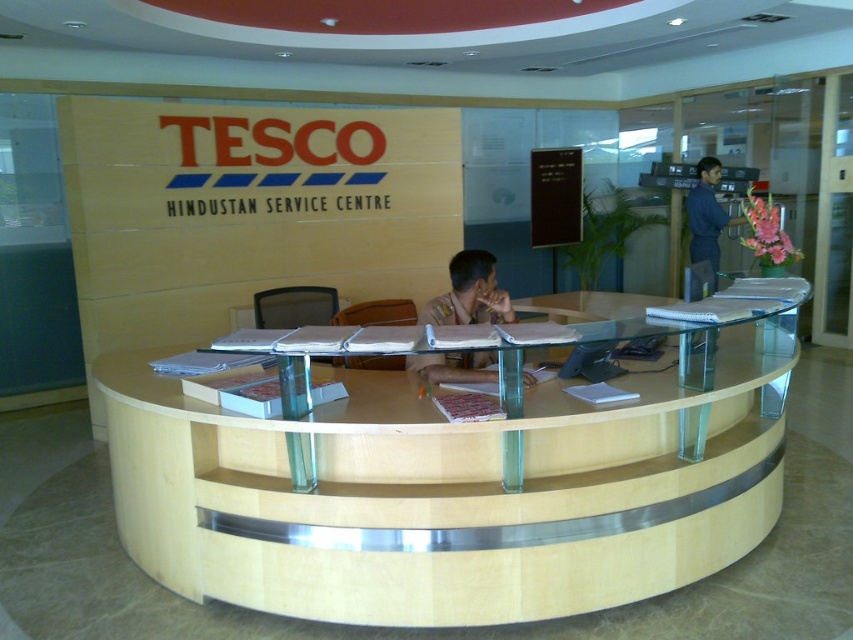
Please provide the 2D coordinates of the brown uniform at center in the image. The coordinates should be in the format of a point with two decimal places, like point x, y.

The 2D coordinates of the brown uniform at center are point [469,292].